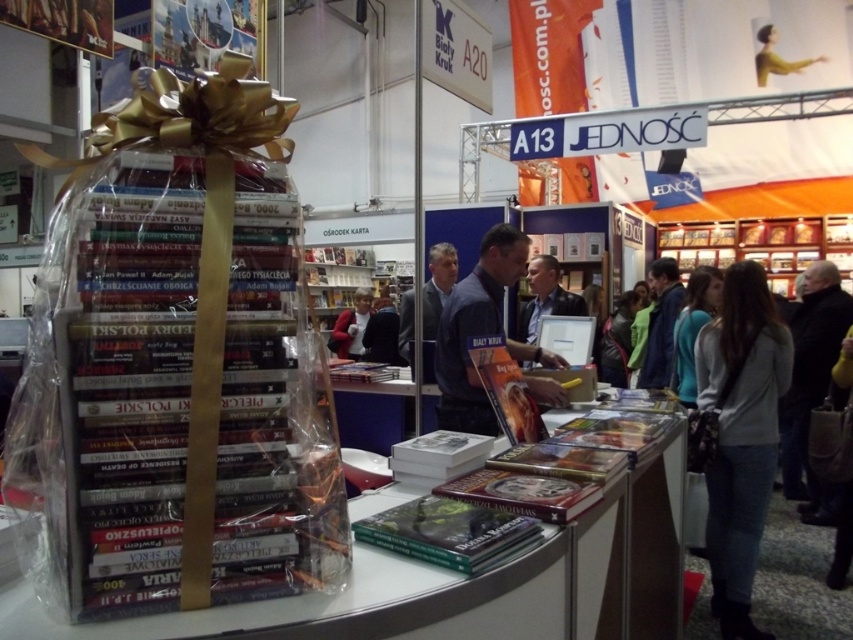
Question: Does dark blue shirt at center have a lesser width compared to dark gray fabric jacket at center?

Choices:
 (A) no
 (B) yes

Answer: (B)

Question: Which point is farther from the camera taking this photo?

Choices:
 (A) (544, 288)
 (B) (793, 404)
 (C) (331, 348)
 (D) (425, 324)

Answer: (C)

Question: Which of the following is the farthest from the observer?

Choices:
 (A) gray sweater at lower right
 (B) matte black jacket at center
 (C) dark blue shirt at center

Answer: (B)

Question: Is gray sweater at lower right wider than dark blue shirt at center?

Choices:
 (A) yes
 (B) no

Answer: (B)

Question: Which object appears farthest from the camera in this image?

Choices:
 (A) blue fabric jacket at lower right
 (B) blue fabric jacket at center
 (C) gray sweater at lower right

Answer: (B)

Question: Does dark blue shirt at center come behind blue fabric jacket at center?

Choices:
 (A) no
 (B) yes

Answer: (A)